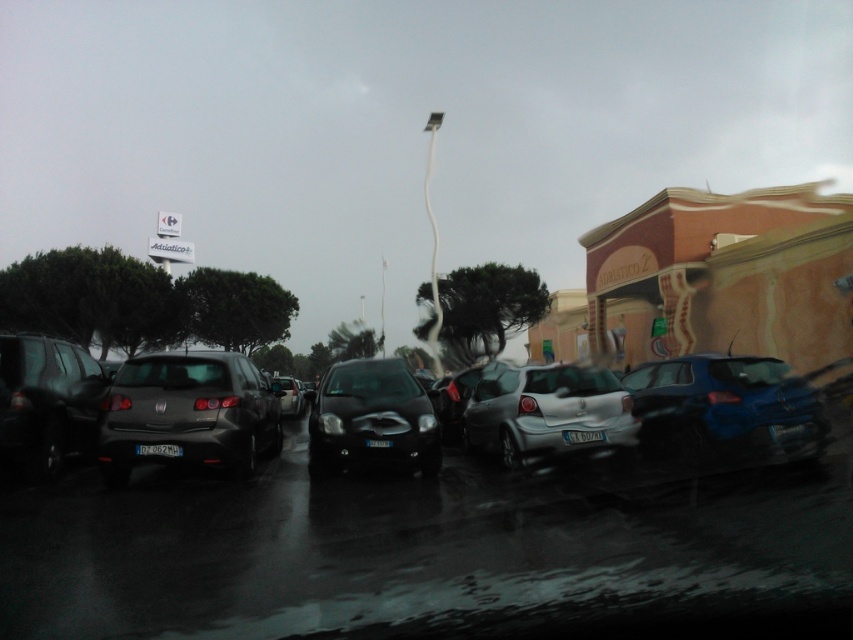
Consider the image. Can you confirm if matte black hatchback at center is shorter than satin silver hatchback at center?

Incorrect, matte black hatchback at center's height does not fall short of satin silver hatchback at center's.

What do you see at coordinates (189, 413) in the screenshot?
I see `matte black hatchback at center` at bounding box center [189, 413].

Where is `matte black hatchback at center`? Image resolution: width=853 pixels, height=640 pixels. matte black hatchback at center is located at coordinates (189, 413).

Can you confirm if glossy black car at center is thinner than satin black car at center?

Incorrect, glossy black car at center's width is not less than satin black car at center's.

Who is shorter, glossy black car at center or satin black car at center?

Standing shorter between the two is satin black car at center.

Who is more distant from viewer, (376, 413) or (291, 387)?

Point (291, 387)

Identify the location of glossy black car at center. (370, 419).

What do you see at coordinates (547, 412) in the screenshot?
I see `satin silver hatchback at center` at bounding box center [547, 412].

The image size is (853, 640). Identify the location of satin silver hatchback at center. (547, 412).